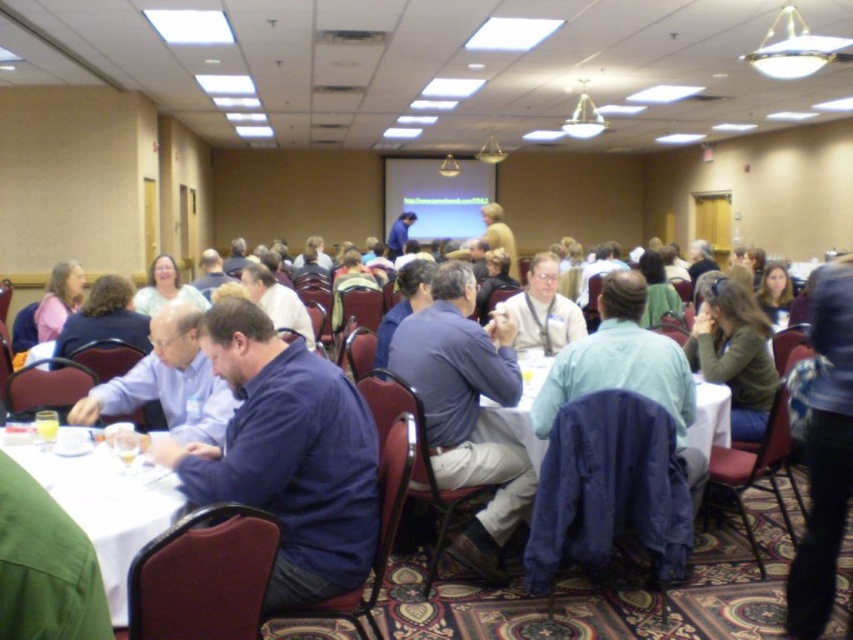
Is dark blue shirt at center bigger than white glossy table at lower left?

Indeed, dark blue shirt at center has a larger size compared to white glossy table at lower left.

Who is more distant from viewer, (305, 422) or (91, 509)?

Point (305, 422)

This screenshot has height=640, width=853. What are the coordinates of `dark blue shirt at center` in the screenshot? It's located at (287, 456).

Who is higher up, dark blue shirt at center or blue cotton shirt at center?

dark blue shirt at center is higher up.

Is point (326, 422) closer to camera compared to point (419, 324)?

Yes, point (326, 422) is in front of point (419, 324).

Locate an element on the screen. dark blue shirt at center is located at coordinates (287, 456).

Locate an element on the screen. Image resolution: width=853 pixels, height=640 pixels. dark blue shirt at center is located at coordinates (287, 456).

Can you confirm if dark blue shirt at center is positioned above white fabric table at center?

Correct, dark blue shirt at center is located above white fabric table at center.

The height and width of the screenshot is (640, 853). What do you see at coordinates (287, 456) in the screenshot?
I see `dark blue shirt at center` at bounding box center [287, 456].

Image resolution: width=853 pixels, height=640 pixels. I want to click on dark blue shirt at center, so click(287, 456).